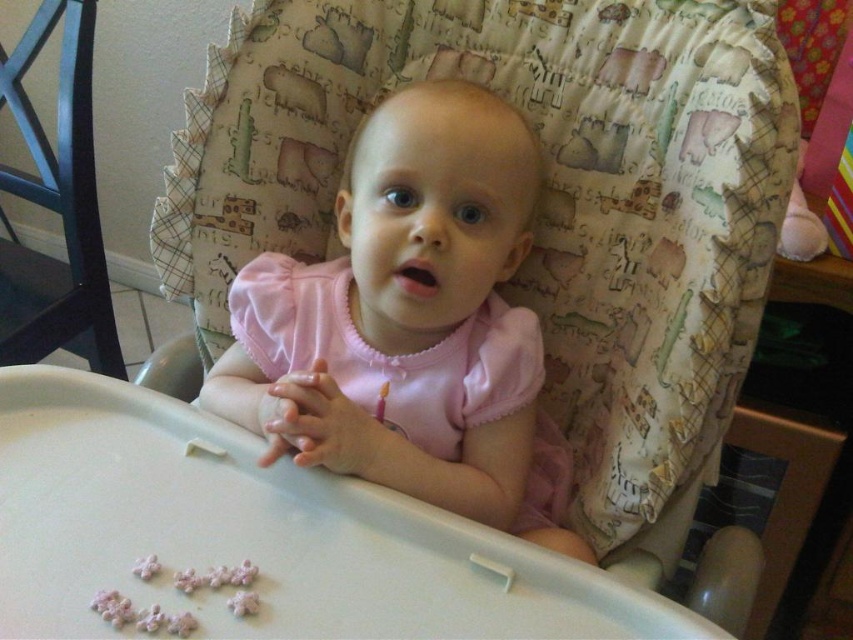
You are a parent trying to ensure your baby doesn not choke. You see the black plastic feeding chair at left and the pink sugar flowers at lower center. Which object is closer to the baby?

The pink sugar flowers at lower center are behind the black plastic feeding chair at left, so the black plastic feeding chair at left is closer to the baby.

You are a parent trying to place a small toy on the table between the black plastic feeding chair at left and the pink sugar flowers at lower center. Considering their heights, which object should you place the toy closer to so it doesn

The black plastic feeding chair at left is taller than the pink sugar flowers at lower center. To ensure the toy is placed at a comfortable height for the baby, you should position it closer to the pink sugar flowers at lower center since it is shorter.